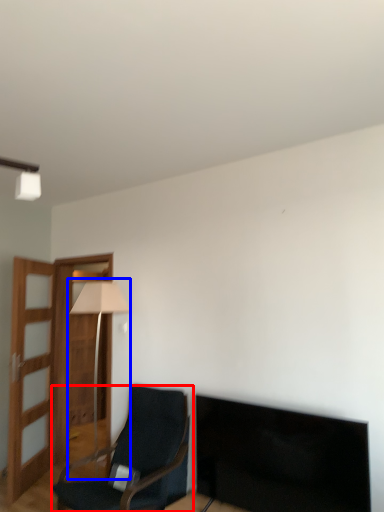
Question: Among these objects, which one is farthest to the camera, chair (highlighted by a red box) or table lamp (highlighted by a blue box)?

Choices:
 (A) chair
 (B) table lamp

Answer: (B)